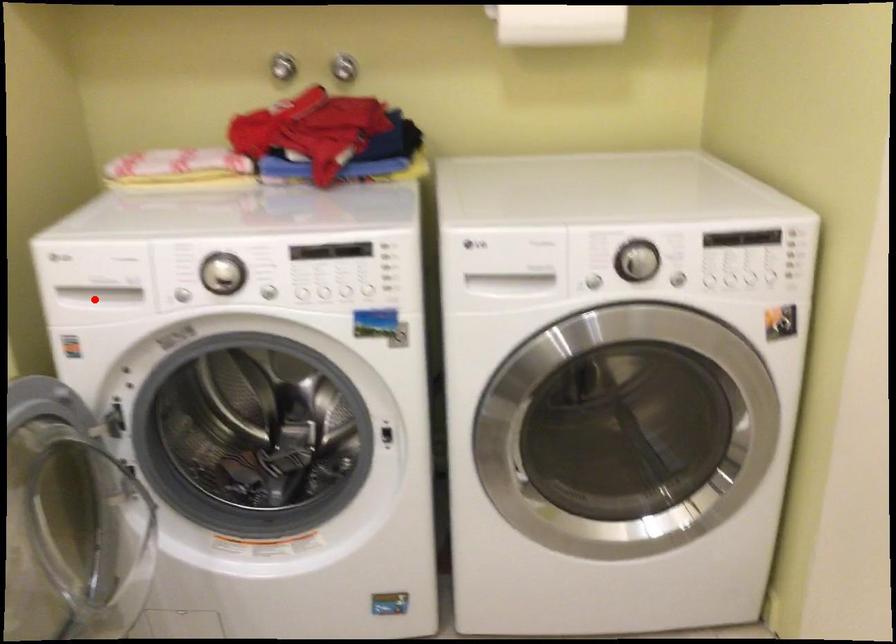
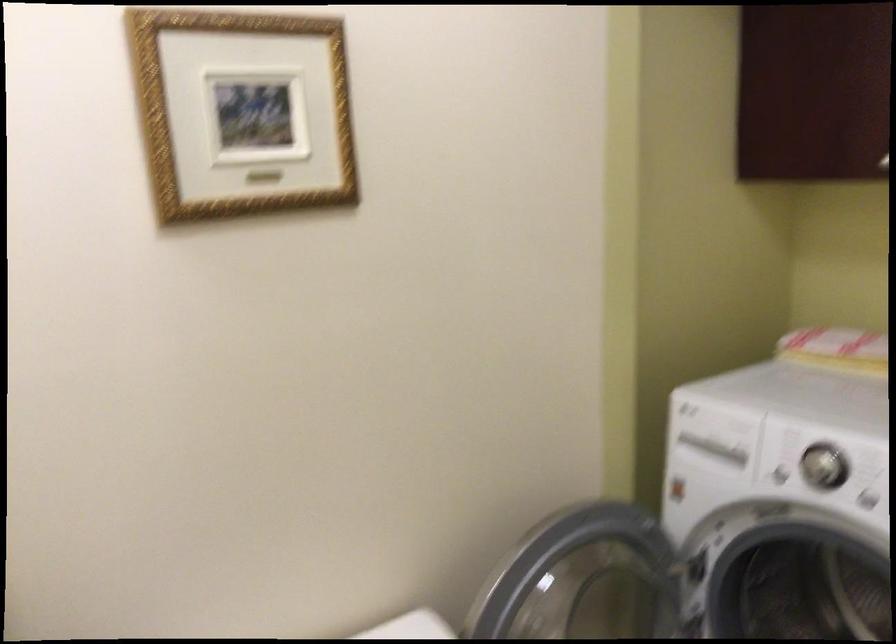
Where in the second image is the point corresponding to the highlighted location from the first image?

(708, 451)